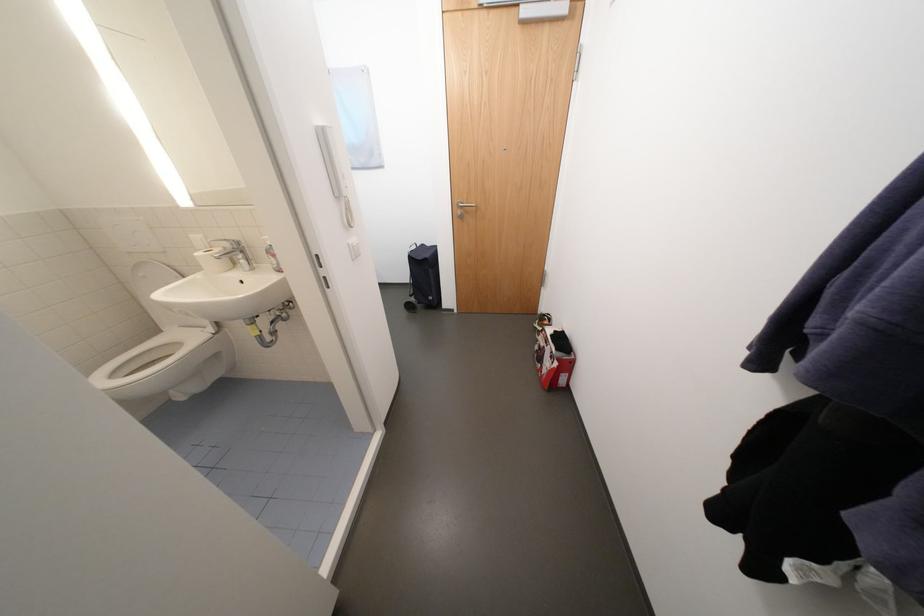
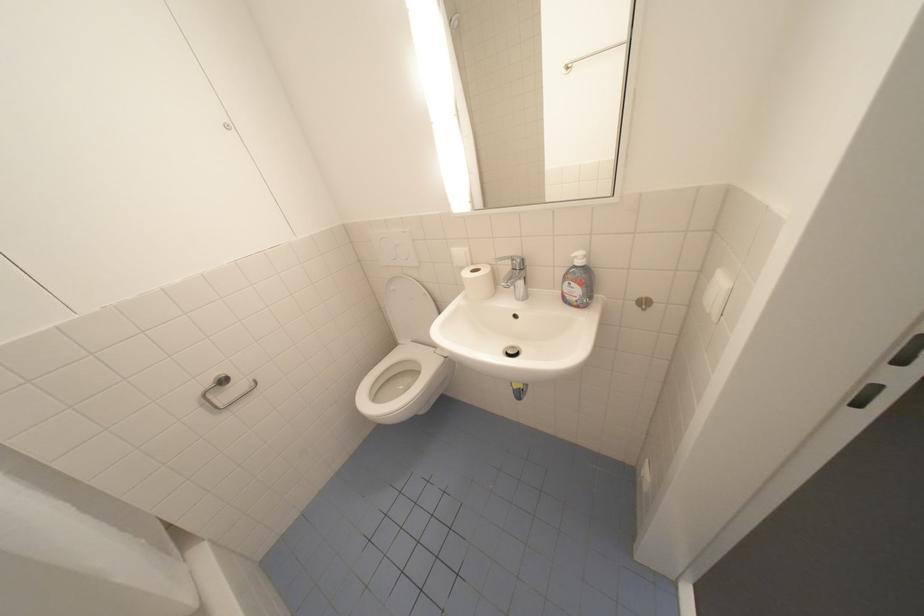
Question: The camera is either moving clockwise (left) or counter-clockwise (right) around the object. The first image is from the beginning of the video and the second image is from the end. Is the camera moving left or right when shooting the video?

Choices:
 (A) Left
 (B) Right

Answer: (B)